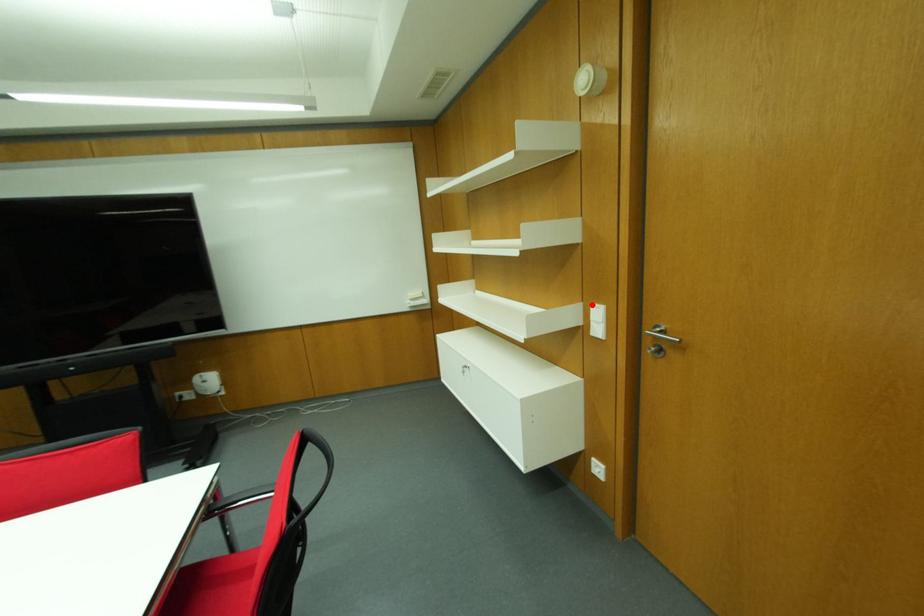
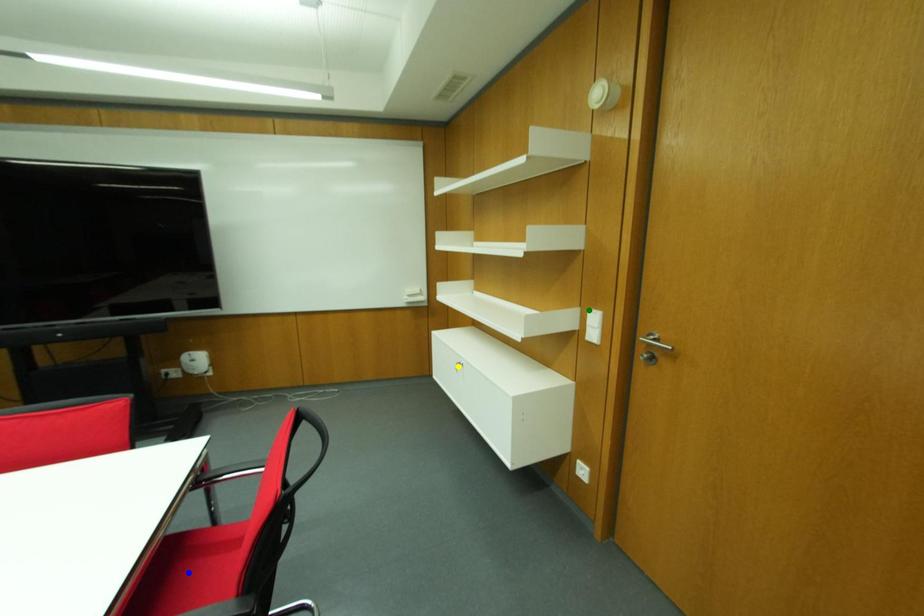
Question: I am providing you with two images of the same scene from different viewpoints. A red point is marked on the first image. You are given multiple points on the second image. Which spot in image 2 lines up with the point in image 1?

Choices:
 (A) yellow point
 (B) blue point
 (C) green point

Answer: (C)